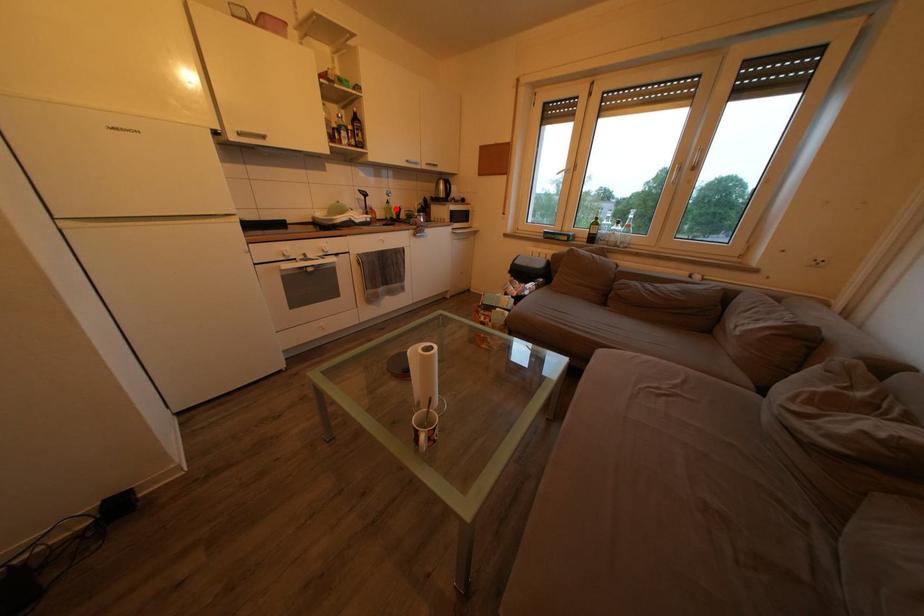
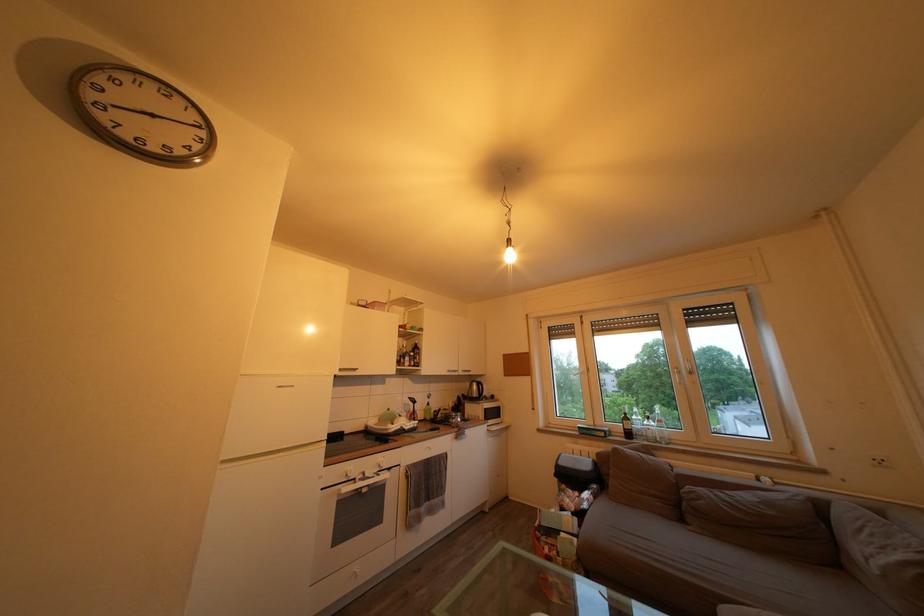
Question: I am providing you with two images of the same scene from different viewpoints. In image1, a red point is highlighted. Considering the same 3D point in image2, which of the following is correct?

Choices:
 (A) It is closer
 (B) It is farther

Answer: (B)